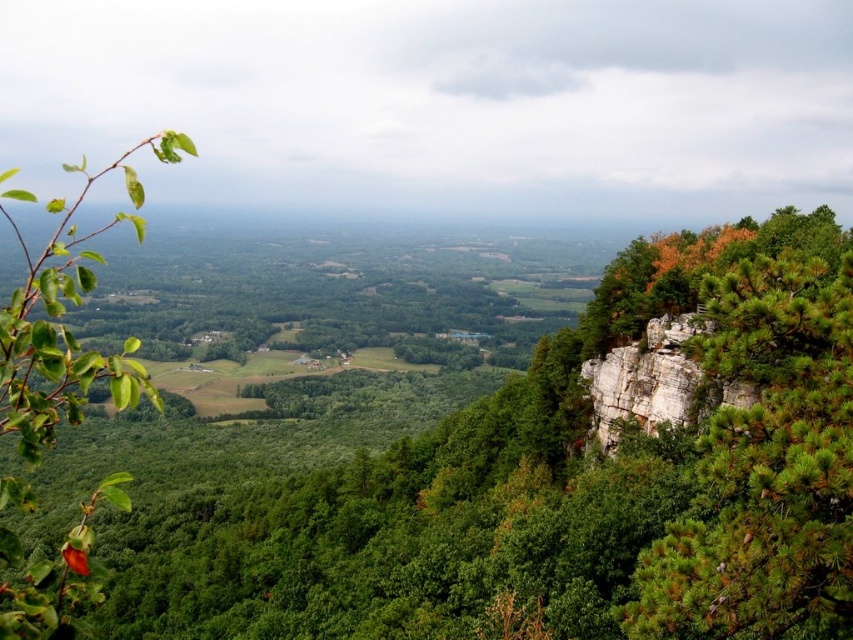
You are standing at the cliff edge and see the green pine tree at right and the green matte leaf at left. Which object is positioned lower in the scene?

The green pine tree at right is located below the green matte leaf at left, so it is positioned lower in the scene.

You are standing at the cliff edge and want to look at two points in the valley. The first point is at coordinate point(622,320) and the second is at point(74,566). Which point is closer to you?

Point(622,320) is closer to you because it is further to the viewer than point(74,566).